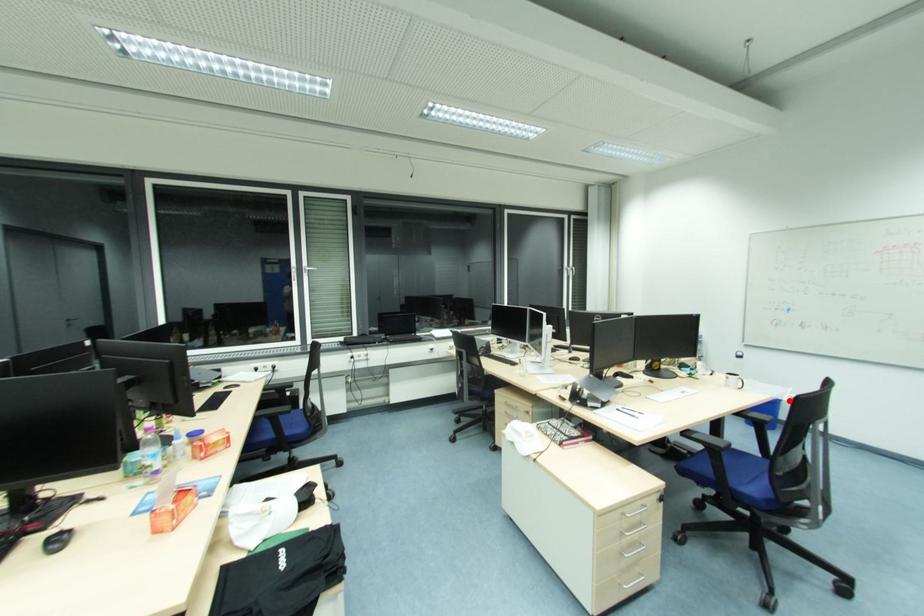
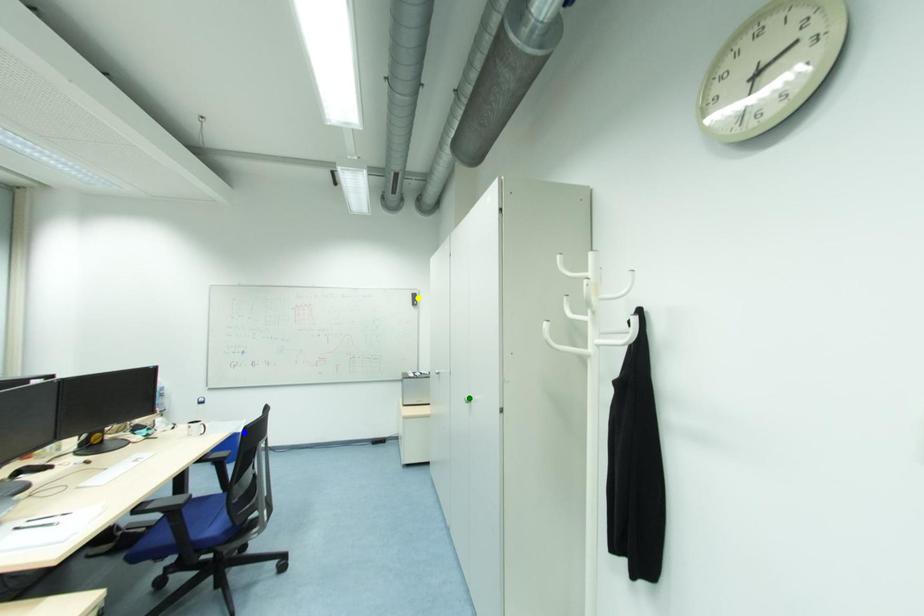
Question: I am providing you with two images of the same scene from different viewpoints. A red point is marked on the first image. You are given multiple points on the second image. Which point in image 2 is actually the same real-world point as the red point in image 1?

Choices:
 (A) blue point
 (B) green point
 (C) yellow point

Answer: (A)